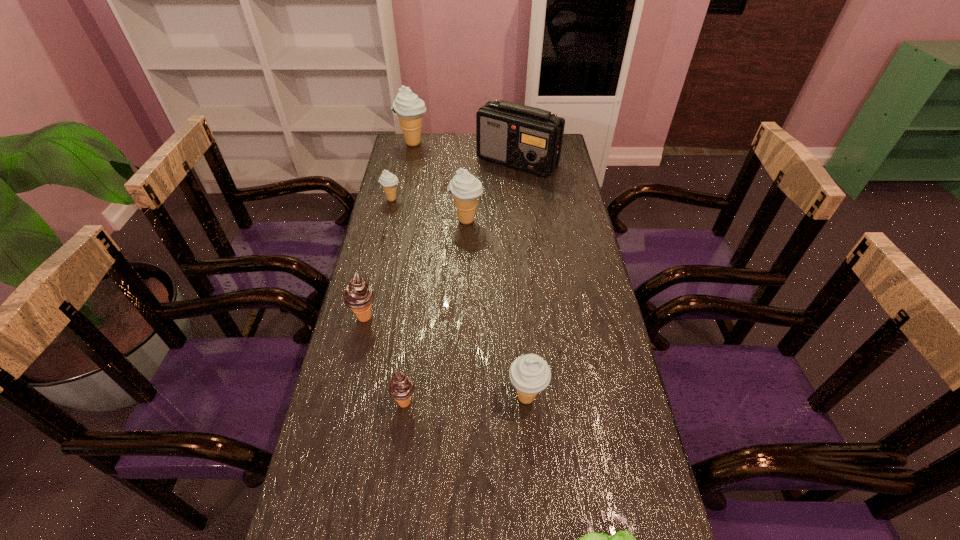
I want to click on the tallest icecream, so click(x=409, y=108).

Locate an element on the screen. the farthest icecream is located at coordinates (409, 108).

The image size is (960, 540). In order to click on radio receiver in this screenshot , I will do `click(526, 138)`.

Image resolution: width=960 pixels, height=540 pixels. I want to click on the third smallest beige icecream, so click(x=466, y=189).

This screenshot has height=540, width=960. I want to click on the second beige icecream from right to left, so click(x=466, y=189).

Where is `the nearest beige icecream`? the nearest beige icecream is located at coordinates (530, 374).

Where is `the third biggest beige icecream`? This screenshot has height=540, width=960. the third biggest beige icecream is located at coordinates (530, 374).

The width and height of the screenshot is (960, 540). Identify the location of the left chocolate icecream. (358, 295).

The height and width of the screenshot is (540, 960). Identify the location of the bigger chocolate icecream. click(358, 295).

In order to click on the smallest beige icecream in this screenshot , I will do `click(389, 181)`.